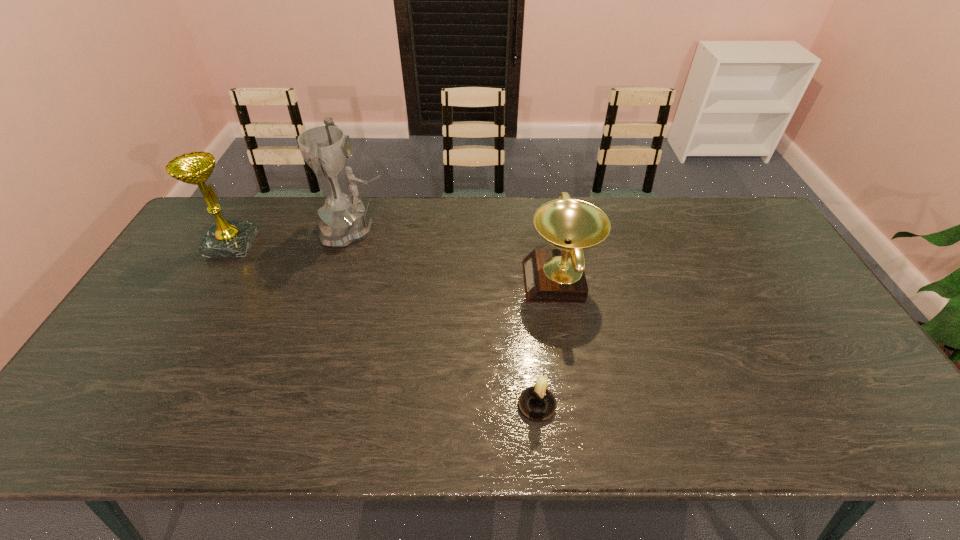
Identify the location of the third object from right to left. The image size is (960, 540). (343, 219).

At what (x,y) coordinates should I click in order to perform the action: click on the tallest object. Please return your answer as a coordinate pair (x, y). This screenshot has width=960, height=540. Looking at the image, I should click on (343, 219).

The width and height of the screenshot is (960, 540). I want to click on the second tallest award, so click(x=225, y=238).

Find the location of `the leftmost object`. the leftmost object is located at coordinates (225, 238).

The height and width of the screenshot is (540, 960). I want to click on the shortest award, so click(550, 275).

Identify the location of the third tallest object. (550, 275).

Identify the location of candle holder. The height and width of the screenshot is (540, 960). [537, 403].

I want to click on the nearest object, so click(537, 403).

Identify the location of vacant region located on the side with emblem of the second award from right to left. This screenshot has height=540, width=960. (440, 230).

Find the location of a particular element. This screenshot has height=540, width=960. free point located 0.080m on the front-facing side of the second shortest award is located at coordinates (277, 244).